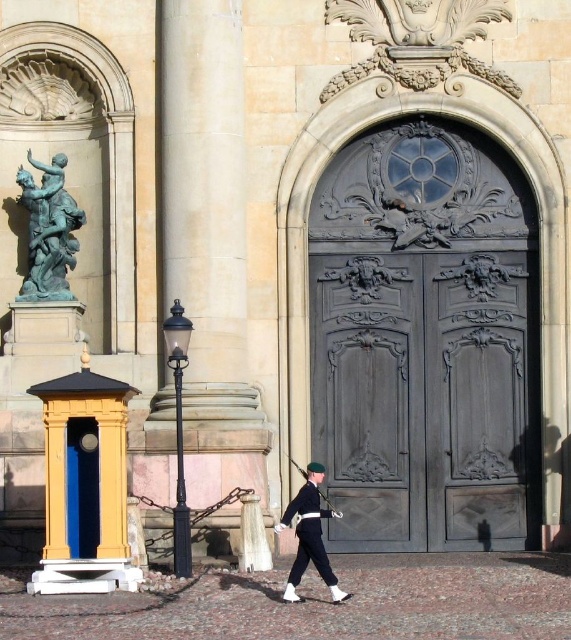
Who is positioned more to the left, dark gray wood door at center or bronze statue at left?

bronze statue at left

What are the coordinates of `dark gray wood door at center` in the screenshot? It's located at (425, 397).

Locate an element on the screen. The width and height of the screenshot is (571, 640). dark gray wood door at center is located at coordinates click(x=425, y=397).

Which is below, dark gray wood door at center or white glossy uniform at center?

white glossy uniform at center

Is point (501, 336) positioned in front of point (296, 579)?

No, it is behind (296, 579).

Between point (525, 371) and point (307, 536), which one is positioned in front?

Point (307, 536) is more forward.

Identify the location of dark gray wood door at center. (425, 397).

How much distance is there between bronze statue at left and blue/grey wood door at center?

They are 14.04 meters apart.

Is bronze statue at left thinner than blue/grey wood door at center?

Incorrect, bronze statue at left's width is not less than blue/grey wood door at center's.

Between point (58, 300) and point (69, 451), which one is positioned in front?

Point (69, 451)

Find the location of a particular element. bronze statue at left is located at coordinates (49, 230).